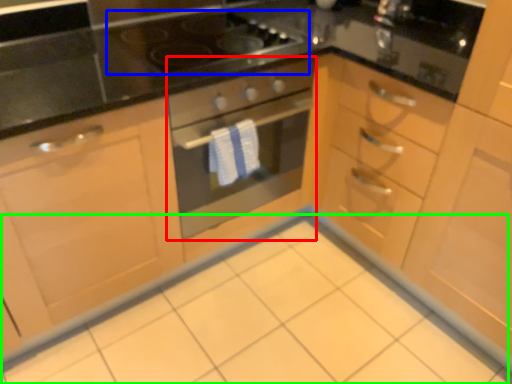
Question: Considering the real-world distances, which object is farthest from oven (highlighted by a red box)? gas stove (highlighted by a blue box) or ceramic tile (highlighted by a green box)?

Choices:
 (A) gas stove
 (B) ceramic tile

Answer: (B)